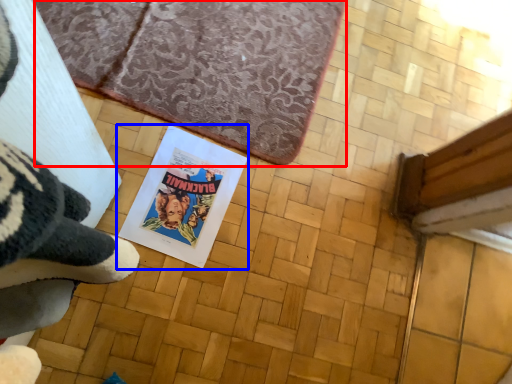
Question: Which object appears farthest to the camera in this image, bath mat (highlighted by a red box) or paperback book (highlighted by a blue box)?

Choices:
 (A) bath mat
 (B) paperback book

Answer: (A)